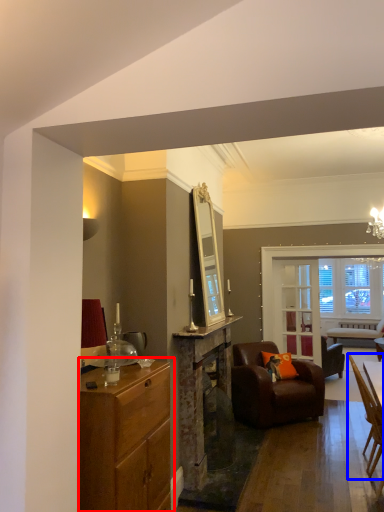
Question: Which point is further to the camera, cabinetry (highlighted by a red box) or chair (highlighted by a blue box)?

Choices:
 (A) cabinetry
 (B) chair

Answer: (B)